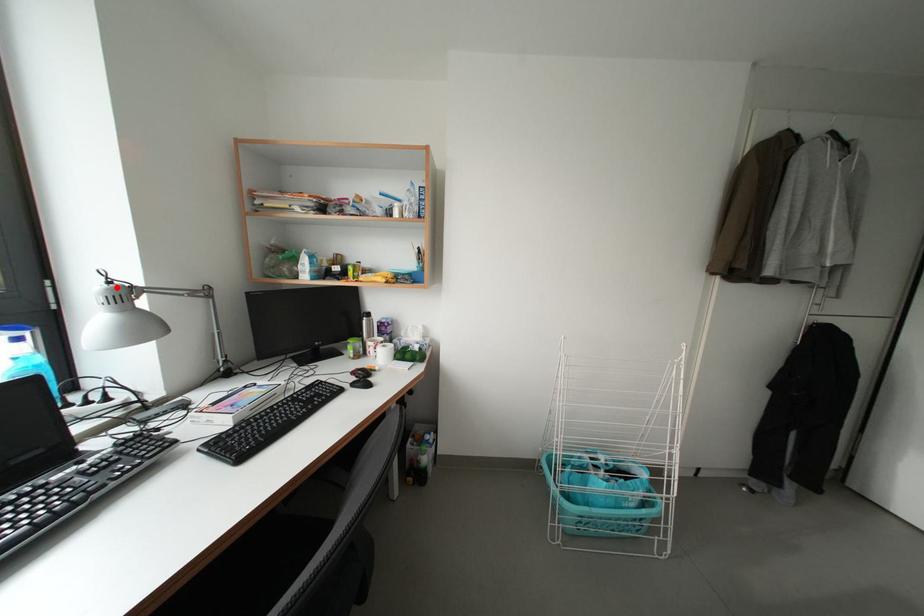
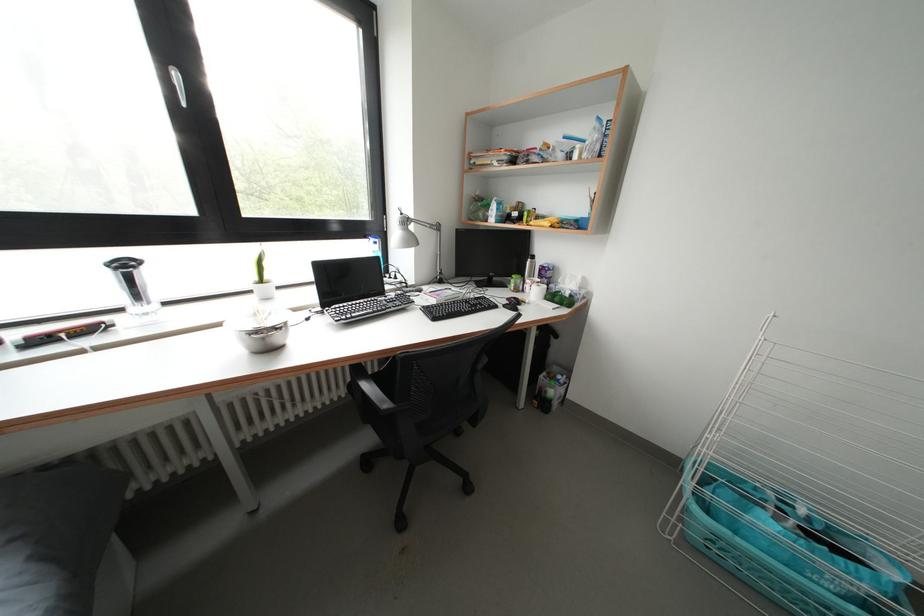
Locate, in the second image, the point that corresponds to the highlighted location in the first image.

(408, 219)